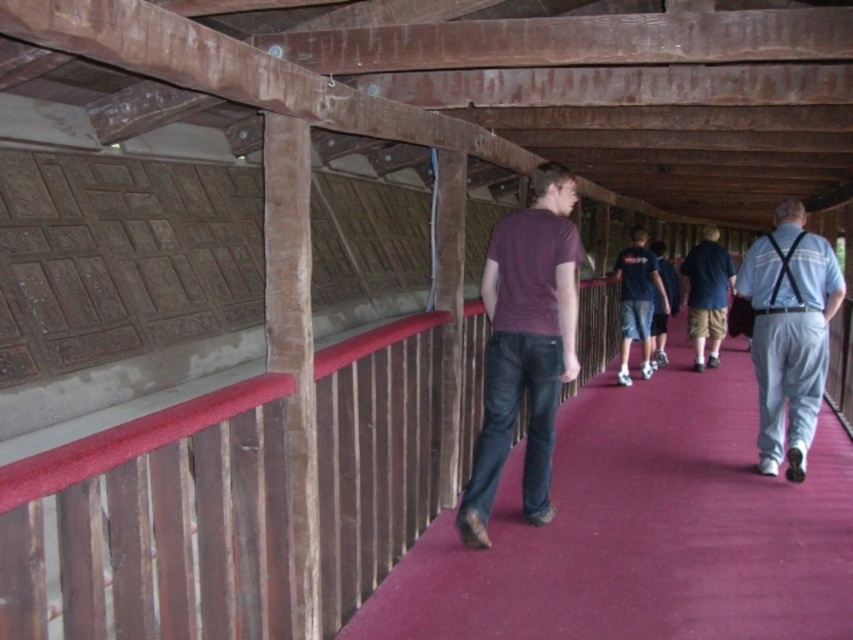
Question: Can you confirm if gray cotton pants at right is positioned below dark blue t-shirt at center?

Choices:
 (A) yes
 (B) no

Answer: (A)

Question: Which of the following is the farthest from the observer?

Choices:
 (A) (616, 612)
 (B) (805, 467)
 (C) (718, 332)

Answer: (C)

Question: Is maroon carpet at center closer to camera compared to gray cotton pants at right?

Choices:
 (A) no
 (B) yes

Answer: (B)

Question: Which point is closer to the camera taking this photo?

Choices:
 (A) (726, 276)
 (B) (723, 552)

Answer: (B)

Question: Among these objects, which one is farthest from the camera?

Choices:
 (A) gray cotton pants at right
 (B) maroon carpet at center

Answer: (A)

Question: Is maroon carpet at center above dark blue shirt at center?

Choices:
 (A) no
 (B) yes

Answer: (A)